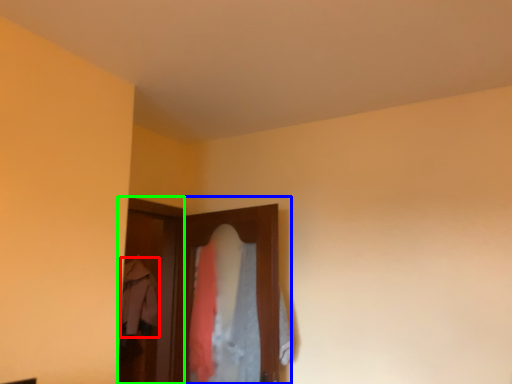
Question: Which object is the farthest from clothing (highlighted by a red box)? Choose among these: closet (highlighted by a blue box) or screen door (highlighted by a green box).

Choices:
 (A) closet
 (B) screen door

Answer: (A)